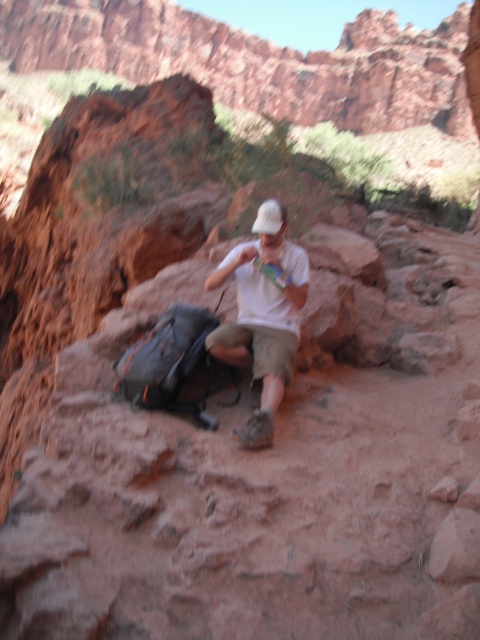
Question: Observing the image, what is the correct spatial positioning of white cotton shirt at center in reference to white matte baseball hat at center?

Choices:
 (A) above
 (B) below

Answer: (B)

Question: Can you confirm if white cotton shirt at center is positioned above white matte baseball hat at center?

Choices:
 (A) no
 (B) yes

Answer: (A)

Question: Among these points, which one is nearest to the camera?

Choices:
 (A) (259, 342)
 (B) (273, 227)

Answer: (A)

Question: Which of the following is the closest to the observer?

Choices:
 (A) white matte baseball hat at center
 (B) white cotton shirt at center

Answer: (B)

Question: Where is white cotton shirt at center located in relation to white matte baseball hat at center in the image?

Choices:
 (A) left
 (B) right

Answer: (A)